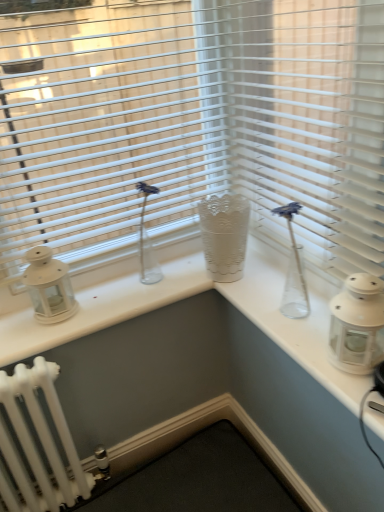
You are a GUI agent. You are given a task and a screenshot of the screen. Output one action in this format:
    pyautogui.click(x=<x>, y=<y>)
    Task: Click on the vacant space underneath white plastic blinds at center (from a real-world perspective)
    
    Given the screenshot: What is the action you would take?
    pyautogui.click(x=285, y=270)